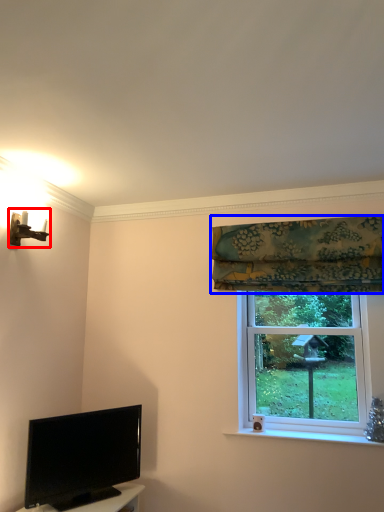
Question: Which object appears closest to the camera in this image, light fixture (highlighted by a red box) or curtain (highlighted by a blue box)?

Choices:
 (A) light fixture
 (B) curtain

Answer: (A)